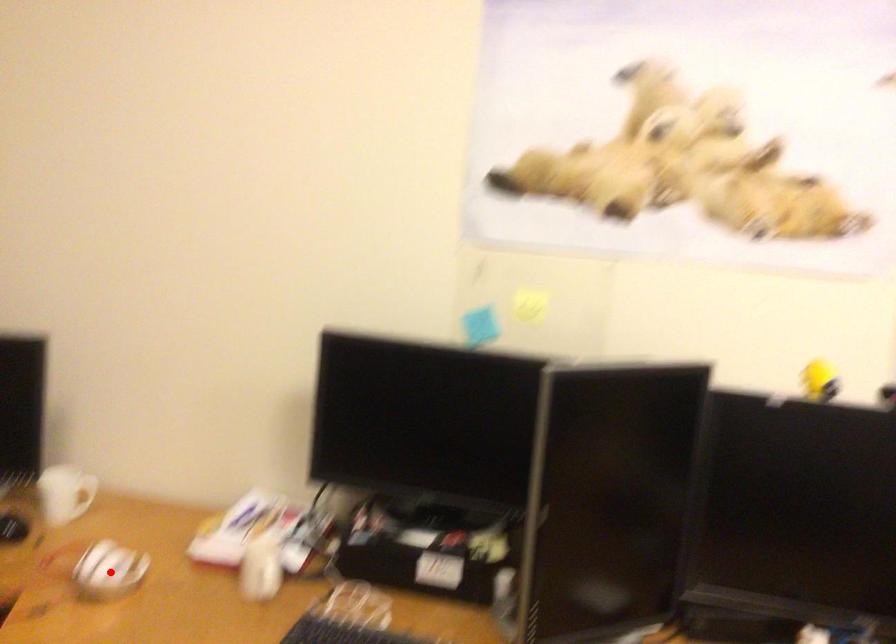
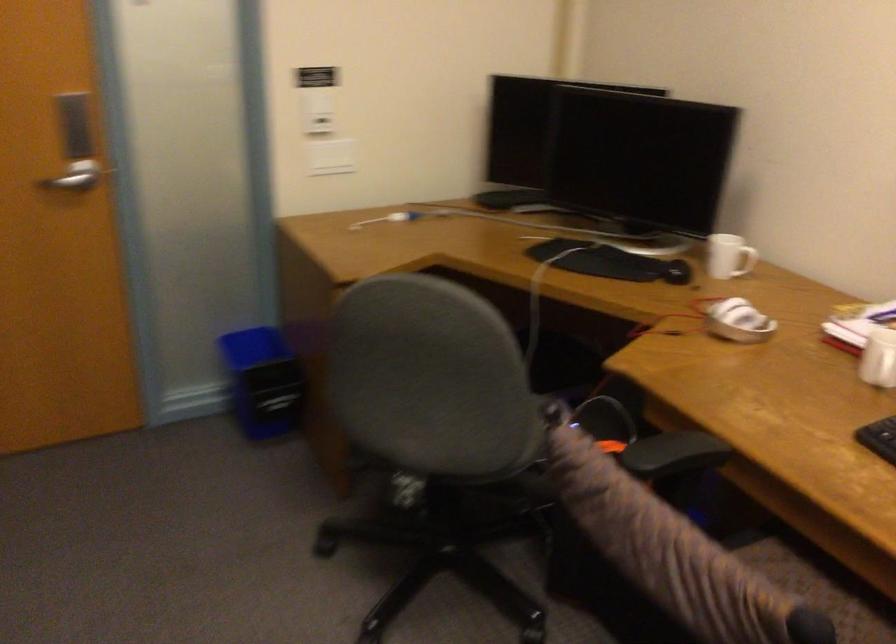
Question: I am providing you with two images of the same scene from different viewpoints. A red point is shown in image1. For the corresponding object point in image2, is it positioned nearer or farther from the camera?

Choices:
 (A) Nearer
 (B) Farther

Answer: (B)